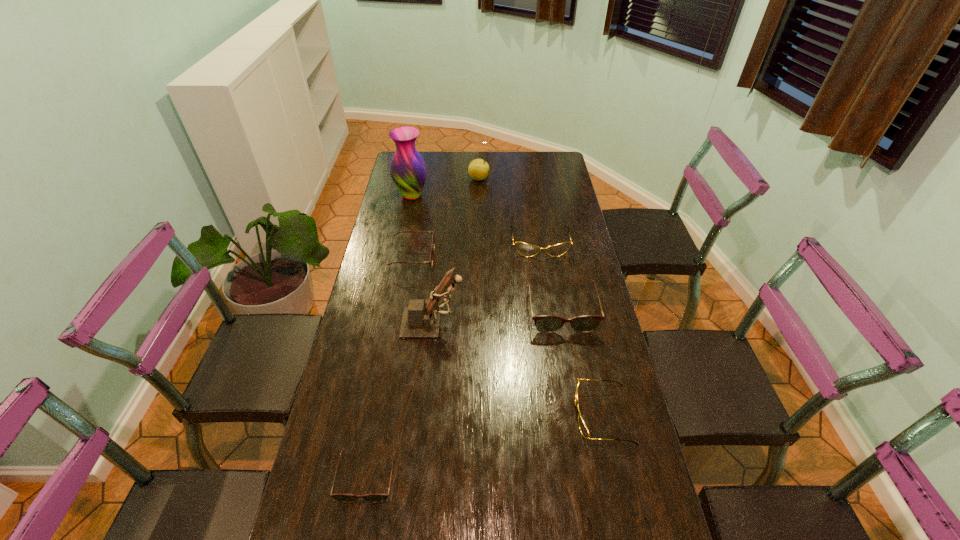
The width and height of the screenshot is (960, 540). In order to click on the eighth nearest object in this screenshot , I will do `click(408, 170)`.

Find the location of a particular element. the tallest object is located at coordinates (408, 170).

Locate an element on the screen. The height and width of the screenshot is (540, 960). the second tallest object is located at coordinates (421, 319).

You are a GUI agent. You are given a task and a screenshot of the screen. Output one action in this format:
    pyautogui.click(x=<x>, y=<y>)
    Task: Click on the figurine
    This screenshot has height=540, width=960.
    Given the screenshot: What is the action you would take?
    pyautogui.click(x=421, y=319)

The image size is (960, 540). Identify the location of yellow softball. (478, 169).

Where is `the farthest object`? The width and height of the screenshot is (960, 540). the farthest object is located at coordinates (478, 169).

The width and height of the screenshot is (960, 540). I want to click on the biggest brown spectacles, so click(544, 323).

Where is `the rightmost brown spectacles`? The width and height of the screenshot is (960, 540). the rightmost brown spectacles is located at coordinates (544, 323).

This screenshot has width=960, height=540. What are the coordinates of `the biggest gold spectacles` in the screenshot? It's located at (528, 250).

This screenshot has width=960, height=540. I want to click on the second smallest brown spectacles, so click(433, 241).